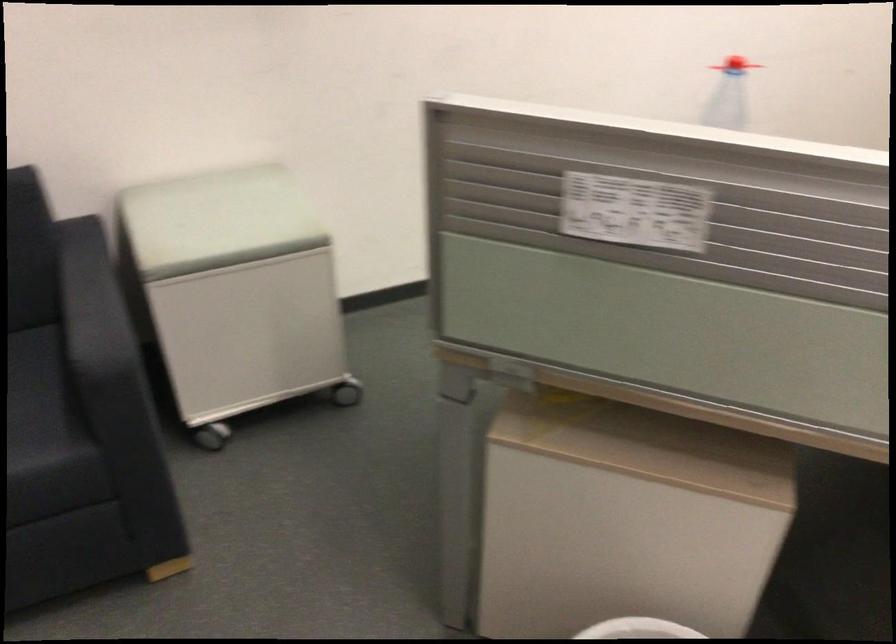
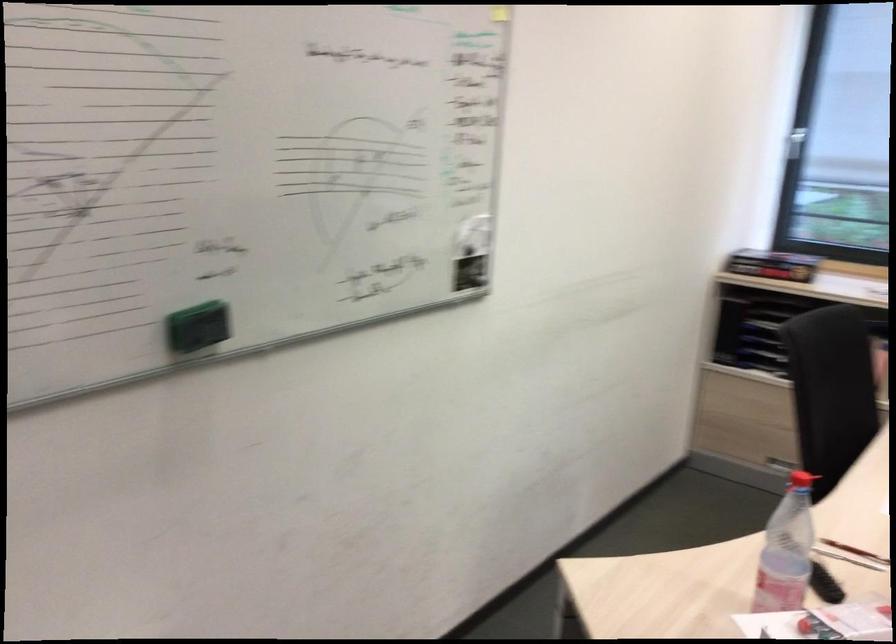
First-person continuous shooting, in which direction is the camera rotating?

The camera's rotation is toward right-up.